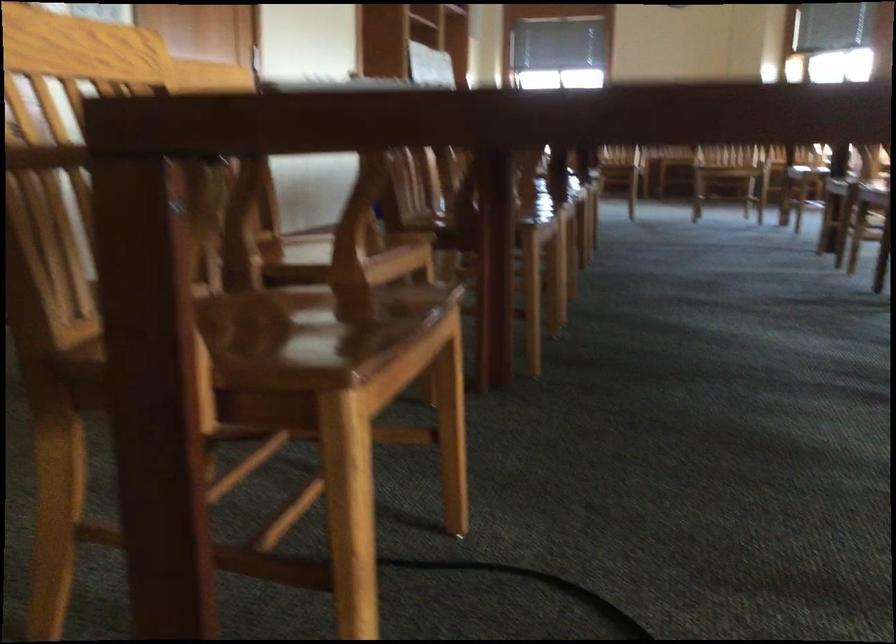
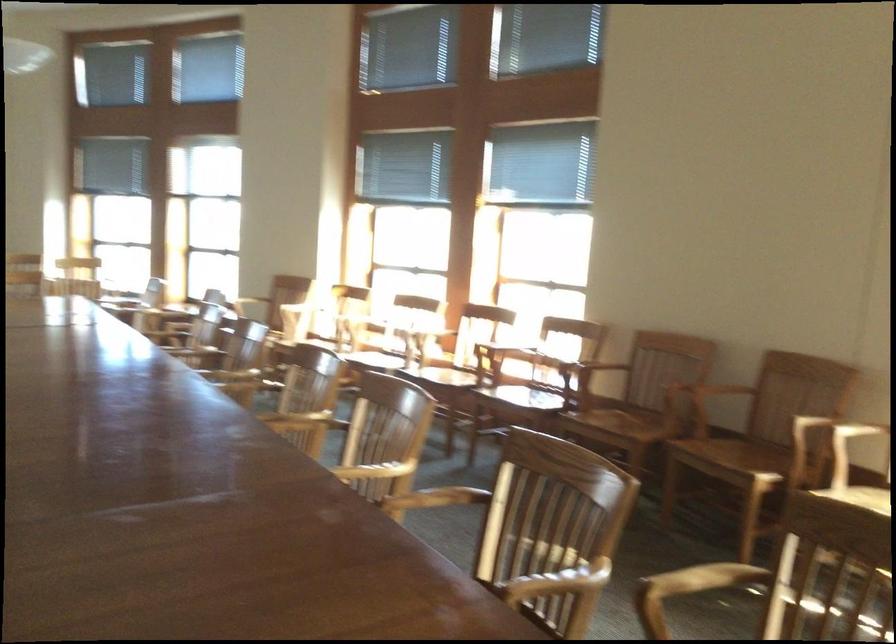
Question: The camera is either moving clockwise (left) or counter-clockwise (right) around the object. The first image is from the beginning of the video and the second image is from the end. Is the camera moving left or right when shooting the video?

Choices:
 (A) Left
 (B) Right

Answer: (A)